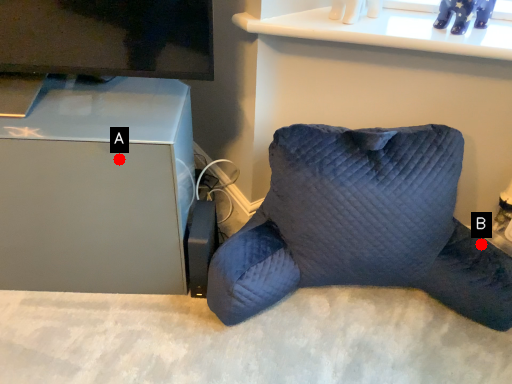
Question: Two points are circled on the image, labeled by A and B beside each circle. Among these points, which one is farthest from the camera?

Choices:
 (A) A is further
 (B) B is further

Answer: (B)